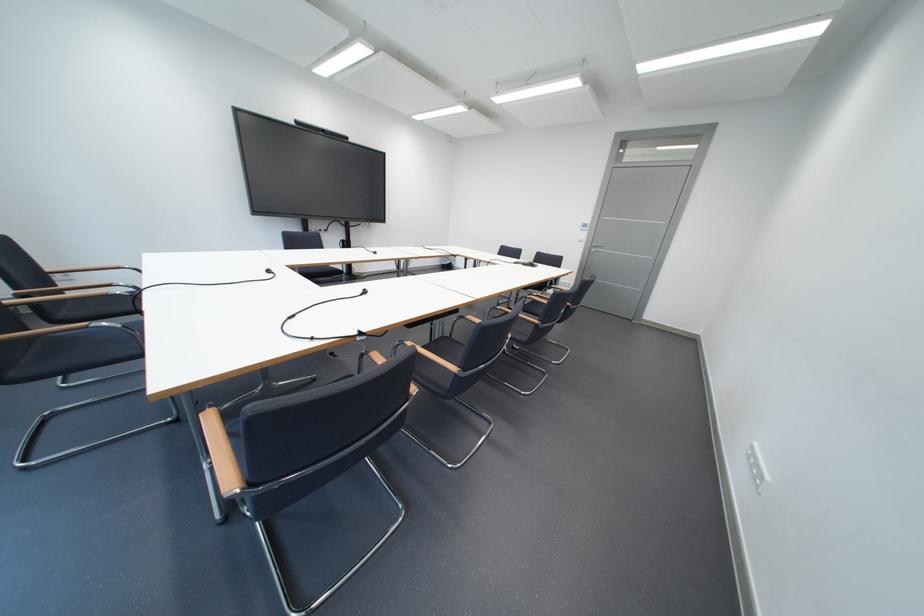
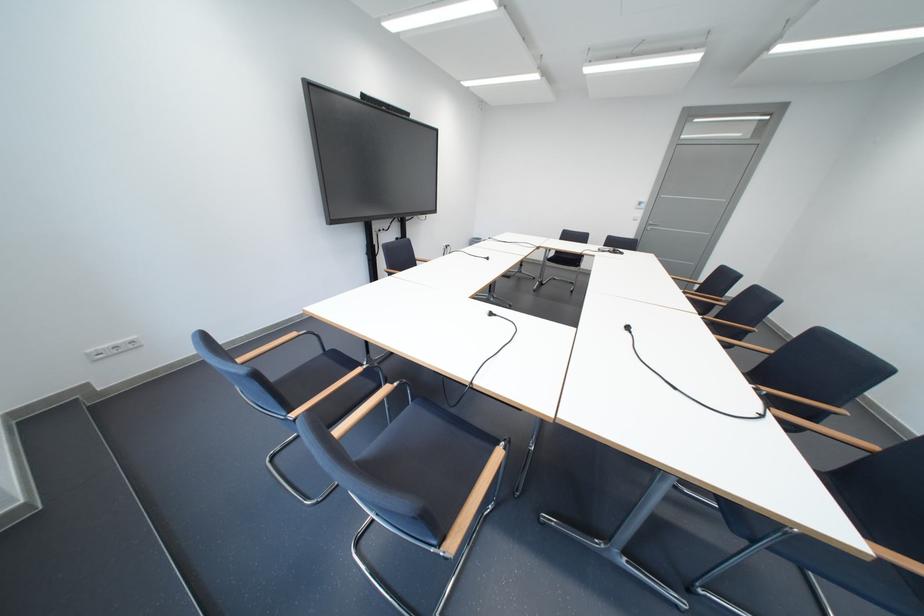
Question: Which direction would the cameraman need to move to produce the second image? Reply with the corresponding letter.

Choices:
 (A) Left
 (B) Right
 (C) Forward
 (D) Backward

Answer: (A)